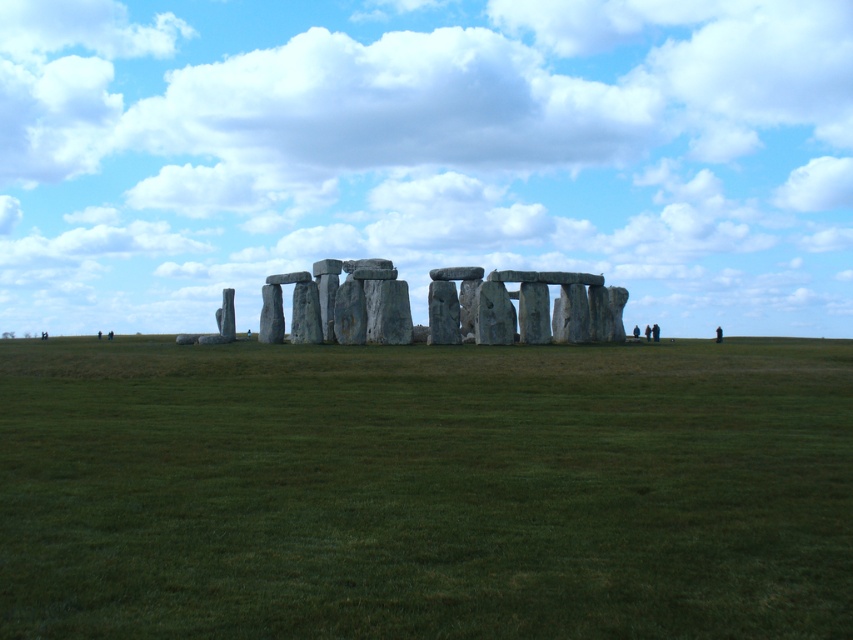
Based on the photo, you are planning to host a picnic at Stonehenge and have a large blanket that covers the entire green grassy field at center. Will the blanket also cover the gray stone circle at center?

The green grassy field at center is larger than the gray stone circle at center, so the blanket covering the entire green grassy field at center would also cover the gray stone circle at center.

You are standing at the entrance of Stonehenge and want to reach the point marked at coordinates point (113, 444). If your walking speed is 1.5 meters per second, how many seconds will it take you to reach that point?

The distance of point (113, 444) from camera is 59.13 meters. At a walking speed of 1.5 meters per second, it will take approximately 39.42 seconds to reach the point.

You are standing at the center of the green grassy field at center. If you walk straight towards the direction of the horizon, will you encounter any obstacles before reaching the edge of the field?

The green grassy field at center is located at point (425, 490), so walking straight towards the horizon from the center would not encounter obstacles as the field is described as vast and stretches towards the horizon.